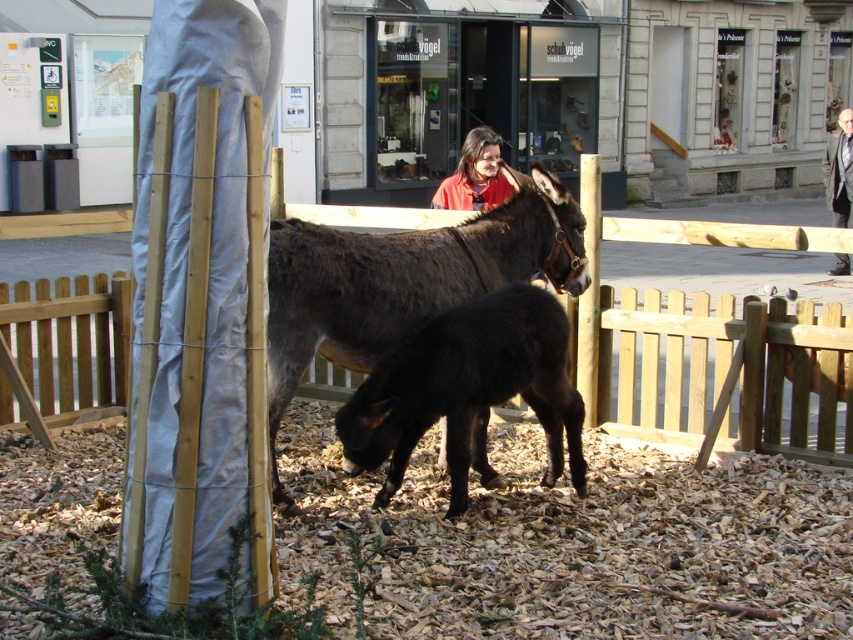
Looking at this image, does dark brown glossy donkey at center have a larger size compared to red matte shirt at center?

No, dark brown glossy donkey at center is not bigger than red matte shirt at center.

Measure the distance between dark brown glossy donkey at center and camera.

dark brown glossy donkey at center is 4.30 meters from camera.

Is point (430, 301) in front of point (433, 204)?

Yes, it is.

Where is `dark brown glossy donkey at center`? This screenshot has height=640, width=853. dark brown glossy donkey at center is located at coordinates (403, 282).

Locate an element on the screen. The image size is (853, 640). wooden fence at center is located at coordinates (664, 362).

Does point (825, 388) lie behind point (500, 164)?

No, it is not.

Is point (625, 358) positioned in front of point (482, 125)?

Yes, it is.

Locate an element on the screen. wooden fence at center is located at coordinates (664, 362).

Can you confirm if wooden fence at center is positioned above dark brown glossy donkey at center?

No.

Does point (817, 314) come in front of point (440, 285)?

No, (817, 314) is behind (440, 285).

The width and height of the screenshot is (853, 640). What are the coordinates of `wooden fence at center` in the screenshot? It's located at (664, 362).